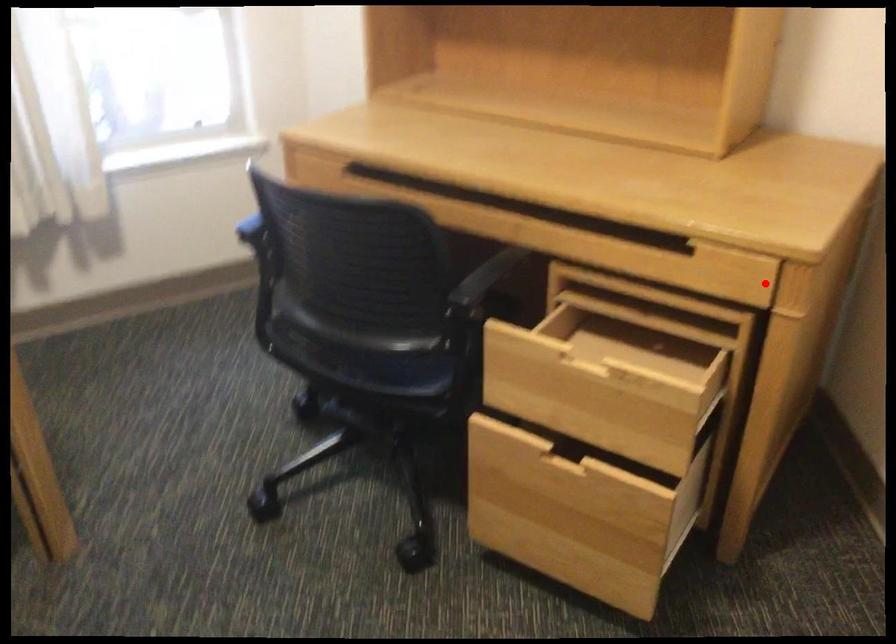
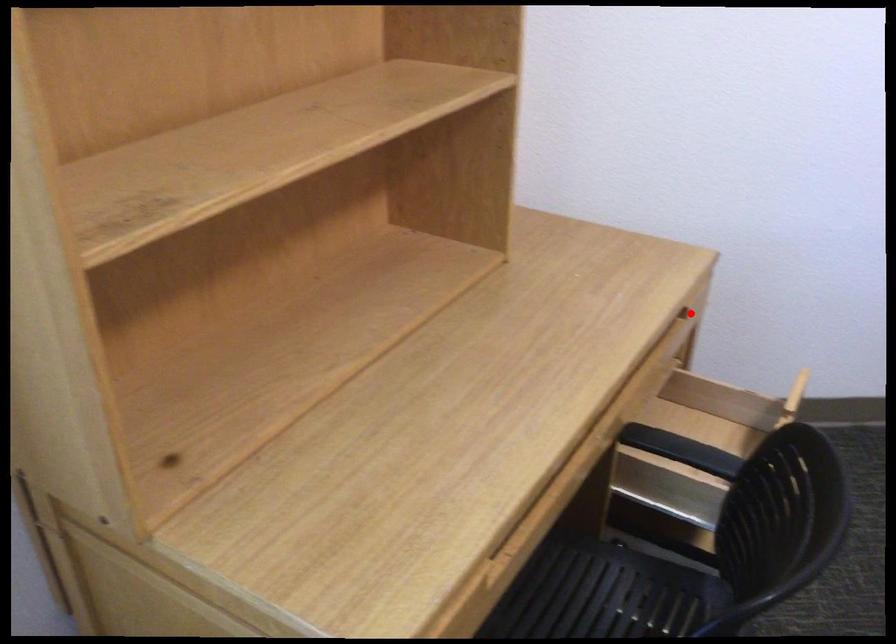
I am providing you with two images of the same scene from different viewpoints. A red point is marked on the first image and another point is marked on the second image. Is the marked point in image1 the same physical position as the marked point in image2?

Yes